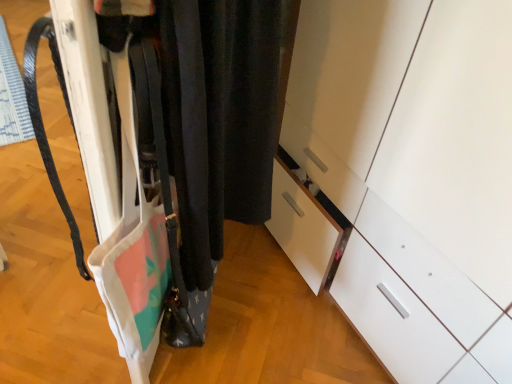
You are a GUI agent. You are given a task and a screenshot of the screen. Output one action in this format:
    pyautogui.click(x=<x>, y=<y>)
    Task: Click on the white matte closet at center
    
    Given the screenshot: What is the action you would take?
    pyautogui.click(x=219, y=112)

This screenshot has width=512, height=384. Describe the element at coordinates (219, 112) in the screenshot. I see `white matte closet at center` at that location.

This screenshot has width=512, height=384. What do you see at coordinates (414, 174) in the screenshot? I see `white glossy cabinet at center` at bounding box center [414, 174].

This screenshot has width=512, height=384. In order to click on white glossy cabinet at center in this screenshot , I will do `click(414, 174)`.

At what (x,y) coordinates should I click in order to perform the action: click on white matte closet at center. Please return your answer as a coordinate pair (x, y). This screenshot has width=512, height=384. Looking at the image, I should click on (219, 112).

Considering the relative positions of white matte closet at center and white glossy cabinet at center in the image provided, is white matte closet at center to the left or to the right of white glossy cabinet at center?

Based on their positions, white matte closet at center is located to the left of white glossy cabinet at center.

Is white matte closet at center in front of white glossy cabinet at center?

Yes, it is in front of white glossy cabinet at center.

Which is closer to the camera, (233, 25) or (435, 296)?

Clearly, point (233, 25) is closer to the camera than point (435, 296).

In the scene shown: From the image's perspective, between white matte closet at center and white glossy cabinet at center, which one is located above?

white matte closet at center is shown above in the image.

From a real-world perspective, between white matte closet at center and white glossy cabinet at center, who is vertically higher?

white matte closet at center is physically above.

Between white matte closet at center and white glossy cabinet at center, which one has larger width?

→ white glossy cabinet at center.

Who is shorter, white matte closet at center or white glossy cabinet at center?

With less height is white matte closet at center.

Between white matte closet at center and white glossy cabinet at center, which one has larger size?

white glossy cabinet at center.

Is white glossy cabinet at center inside white matte closet at center?

Actually, white glossy cabinet at center is outside white matte closet at center.

Is white matte closet at center far from white glossy cabinet at center?

No, white matte closet at center is not far away from white glossy cabinet at center.

Is white matte closet at center looking in the opposite direction of white glossy cabinet at center?

No, white matte closet at center's orientation is not away from white glossy cabinet at center.

How much distance is there between white matte closet at center and white glossy cabinet at center?

A distance of 18.24 inches exists between white matte closet at center and white glossy cabinet at center.

Identify the location of closet that appears above the white glossy cabinet at center (from a real-world perspective). (219, 112).

Which is more to the left, white glossy cabinet at center or white matte closet at center?

Positioned to the left is white matte closet at center.

Who is more distant, white glossy cabinet at center or white matte closet at center?

white glossy cabinet at center is further from the camera.

Does point (347, 22) appear closer or farther from the camera than point (266, 199)?

Point (347, 22).

From the image's perspective, which one is positioned lower, white glossy cabinet at center or white matte closet at center?

white glossy cabinet at center is shown below in the image.

From a real-world perspective, is white glossy cabinet at center physically above white matte closet at center?

No, from a real-world perspective, white glossy cabinet at center is not over white matte closet at center

Is white glossy cabinet at center wider or thinner than white matte closet at center?

white glossy cabinet at center is wider than white matte closet at center.

Considering the sizes of objects white glossy cabinet at center and white matte closet at center in the image provided, who is taller, white glossy cabinet at center or white matte closet at center?

With more height is white glossy cabinet at center.

Considering the relative sizes of white glossy cabinet at center and white matte closet at center in the image provided, is white glossy cabinet at center smaller than white matte closet at center?

No, white glossy cabinet at center is not smaller than white matte closet at center.

From the picture: Do you think white glossy cabinet at center is within white matte closet at center, or outside of it?

white glossy cabinet at center lies outside white matte closet at center.

Is there a large distance between white glossy cabinet at center and white matte closet at center?

That's not correct — white glossy cabinet at center is a little close to white matte closet at center.

Could you tell me if white glossy cabinet at center is turned towards white matte closet at center?

Yes.

Image resolution: width=512 pixels, height=384 pixels. Identify the location of cabinetry lying on the right of white matte closet at center. (414, 174).

Identify the location of closet on the left of white glossy cabinet at center. (219, 112).

At what (x,y) coordinates should I click in order to perform the action: click on cabinetry that appears behind the white matte closet at center. Please return your answer as a coordinate pair (x, y). Looking at the image, I should click on (414, 174).